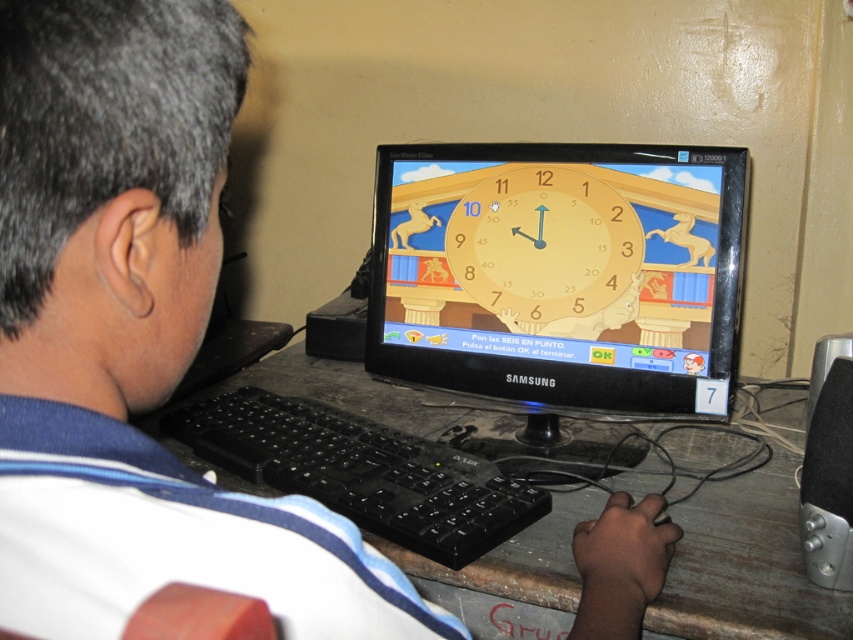
Question: Is matte plastic monitor at center to the right of wooden desk at center from the viewer's perspective?

Choices:
 (A) no
 (B) yes

Answer: (B)

Question: Which object appears farthest from the camera in this image?

Choices:
 (A) black plastic keyboard at center
 (B) matte plastic monitor at center

Answer: (B)

Question: Which of the following is the closest to the observer?

Choices:
 (A) (552, 256)
 (B) (753, 630)
 (C) (421, 380)
 (D) (317, 445)

Answer: (B)

Question: From the image, what is the correct spatial relationship of matte plastic monitor at center in relation to black plastic keyboard at center?

Choices:
 (A) above
 (B) below

Answer: (A)

Question: Estimate the real-world distances between objects in this image. Which object is farther from the yellow matte clock at center?

Choices:
 (A) black plastic keyboard at center
 (B) matte plastic monitor at center

Answer: (A)

Question: Is black plastic keyboard at center further to camera compared to yellow matte clock at center?

Choices:
 (A) no
 (B) yes

Answer: (A)